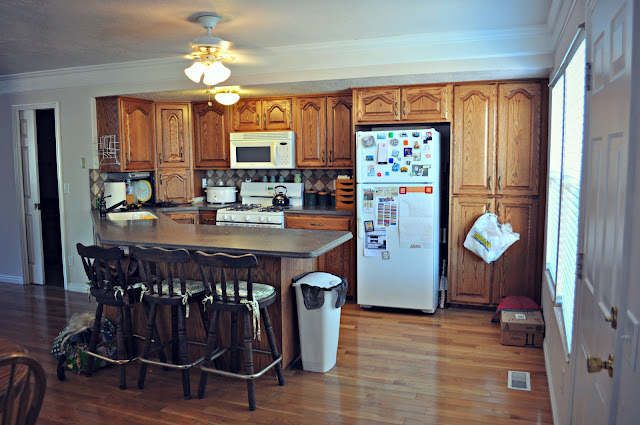
This screenshot has width=640, height=425. What are the coordinates of `door` in the screenshot? It's located at (616, 193), (29, 166).